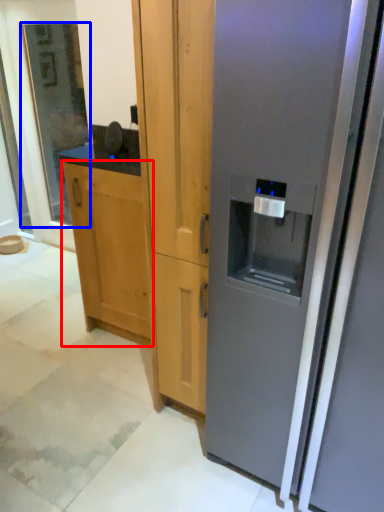
Question: Which point is closer to the camera, cabinetry (highlighted by a red box) or glass door (highlighted by a blue box)?

Choices:
 (A) cabinetry
 (B) glass door

Answer: (A)